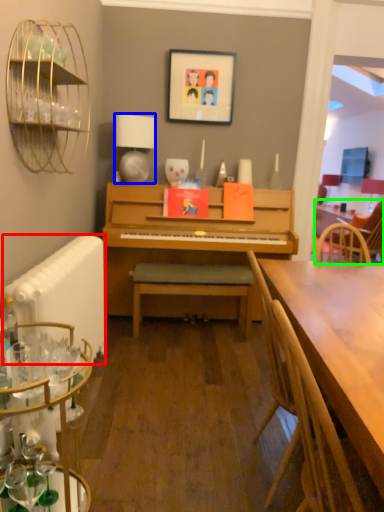
Question: Which object is the closest to the radiator (highlighted by a red box)? Choose among these: lamp (highlighted by a blue box) or chair (highlighted by a green box).

Choices:
 (A) lamp
 (B) chair

Answer: (A)